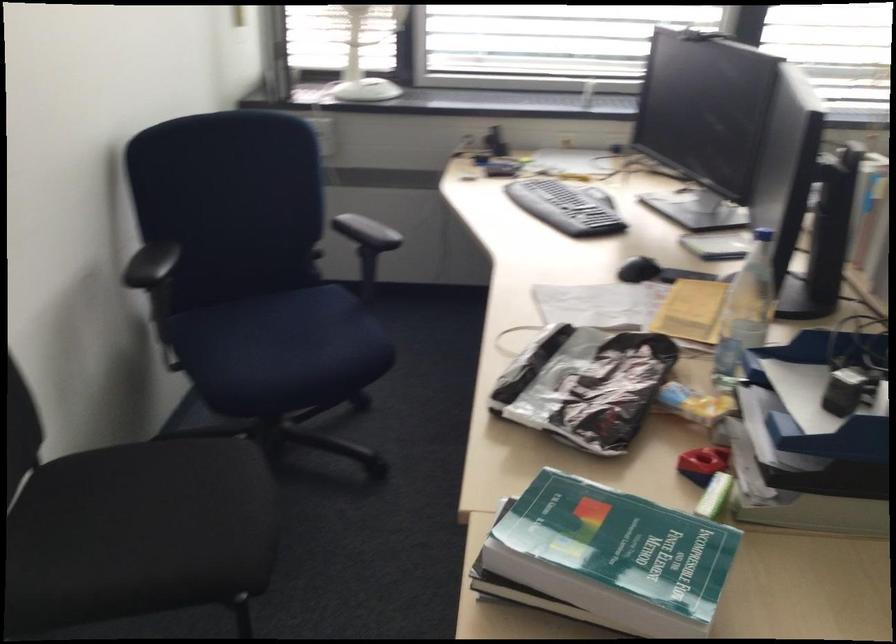
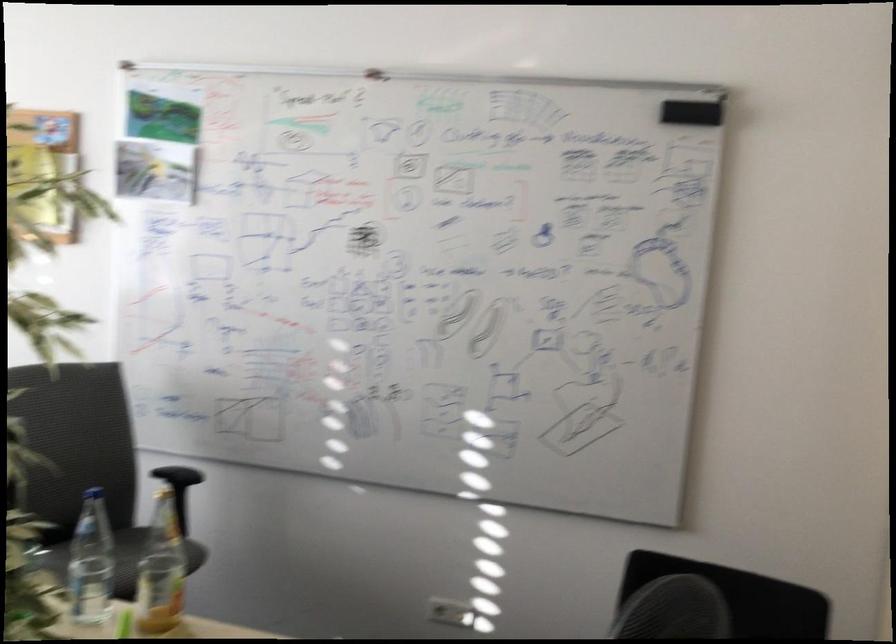
Question: The camera is either moving clockwise (left) or counter-clockwise (right) around the object. The first image is from the beginning of the video and the second image is from the end. Is the camera moving left or right when shooting the video?

Choices:
 (A) Left
 (B) Right

Answer: (A)